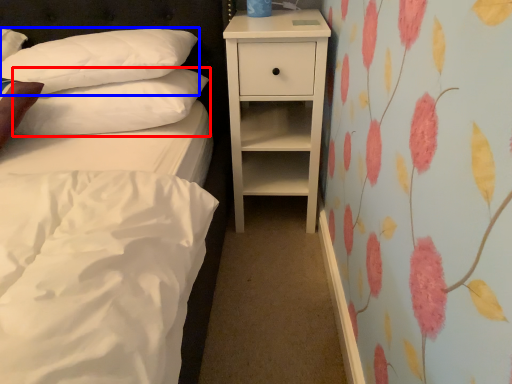
Question: Which of the following is the farthest to the observer, pillow (highlighted by a red box) or pillow (highlighted by a blue box)?

Choices:
 (A) pillow
 (B) pillow

Answer: (A)